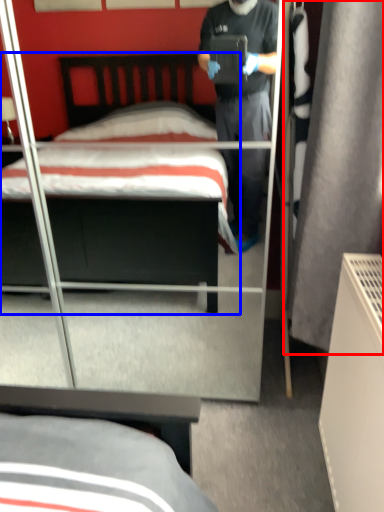
Question: Which of the following is the farthest to the observer, curtain (highlighted by a red box) or bed (highlighted by a blue box)?

Choices:
 (A) curtain
 (B) bed

Answer: (B)